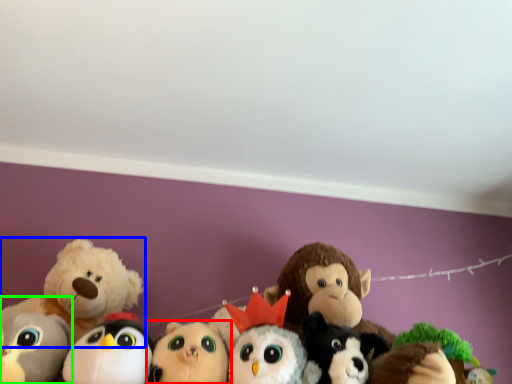
Question: Which object is the closest to the toy (highlighted by a red box)? Choose among these: toy (highlighted by a blue box) or toy (highlighted by a green box).

Choices:
 (A) toy
 (B) toy

Answer: (B)